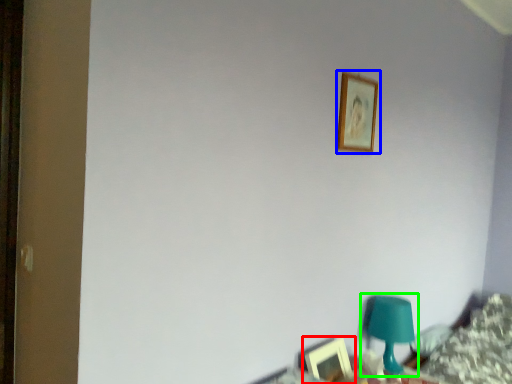
Question: Which object is positioned farthest from picture frame (highlighted by a red box)? Select from picture frame (highlighted by a blue box) and table lamp (highlighted by a green box).

Choices:
 (A) picture frame
 (B) table lamp

Answer: (A)